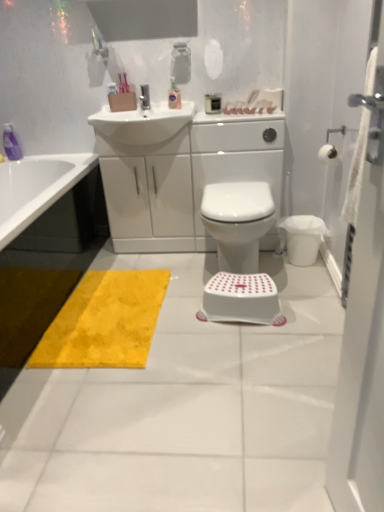
Describe the element at coordinates (105, 322) in the screenshot. I see `yellow fuzzy rug at lower left` at that location.

Describe the element at coordinates (238, 222) in the screenshot. I see `white plastic bidet at center` at that location.

This screenshot has width=384, height=512. What do you see at coordinates (145, 97) in the screenshot?
I see `metallic silver faucet at upper center` at bounding box center [145, 97].

Based on the photo, what is the approximate width of translucent plastic bottle at upper center?

The width of translucent plastic bottle at upper center is 4.55 inches.

What is the approximate width of white plastic step stool at center?

The width of white plastic step stool at center is 27.04 centimeters.

Image resolution: width=384 pixels, height=512 pixels. What do you see at coordinates (327, 153) in the screenshot?
I see `white matte toilet paper at upper right` at bounding box center [327, 153].

This screenshot has height=512, width=384. What do you see at coordinates (142, 123) in the screenshot? I see `white glossy sink at upper center` at bounding box center [142, 123].

The image size is (384, 512). Find the location of `yellow fuzzy rug at lower left`. yellow fuzzy rug at lower left is located at coordinates (105, 322).

Considering the positions of point (379, 499) and point (321, 152), is point (379, 499) closer or farther from the camera than point (321, 152)?

Point (379, 499).

Locate an element on the screen. The width and height of the screenshot is (384, 512). screen door located below the white matte toilet paper at upper right (from the image's perspective) is located at coordinates (362, 351).

Looking at this image, is white fabric screen door at right wider than white matte toilet paper at upper right?

In fact, white fabric screen door at right might be narrower than white matte toilet paper at upper right.

Choose the correct answer: Is white fabric screen door at right inside white matte toilet paper at upper right or outside it?

white fabric screen door at right exists outside the volume of white matte toilet paper at upper right.

Looking at this image, is white plastic step stool at center situated inside white glossy sink at upper center or outside?

white plastic step stool at center is not inside white glossy sink at upper center, it's outside.

Which is closer to the camera, [267,286] or [193,116]?

The point [267,286] is closer.

Which of these two, white plastic step stool at center or white glossy sink at upper center, is smaller?

With smaller size is white plastic step stool at center.

Is metallic silver faucet at upper center taller or shorter than white plastic bidet at center?

Clearly, metallic silver faucet at upper center is shorter compared to white plastic bidet at center.

Could white plastic bidet at center be considered to be inside metallic silver faucet at upper center?

No, metallic silver faucet at upper center does not contain white plastic bidet at center.

Which point is more forward, (146, 87) or (266, 226)?

The point (266, 226) is closer to the camera.

Which of these two, yellow fuzzy rug at lower left or white matte toilet paper at upper right, stands shorter?

yellow fuzzy rug at lower left.

From a real-world perspective, is yellow fuzzy rug at lower left over white matte toilet paper at upper right?

No, from a real-world perspective, yellow fuzzy rug at lower left is not over white matte toilet paper at upper right

Is white matte toilet paper at upper right at the back of yellow fuzzy rug at lower left?

No, yellow fuzzy rug at lower left's orientation is not away from white matte toilet paper at upper right.

Which point is more distant from viewer, (115,283) or (332,146)?

The point (115,283) is farther.

Is white fabric screen door at right far from translucent plastic bottle at upper center?

white fabric screen door at right is positioned a significant distance from translucent plastic bottle at upper center.

Who is shorter, white fabric screen door at right or translucent plastic bottle at upper center?

translucent plastic bottle at upper center is shorter.

Is white fabric screen door at right turned away from translucent plastic bottle at upper center?

white fabric screen door at right is not turned away from translucent plastic bottle at upper center.

This screenshot has height=512, width=384. I want to click on tap located below the translucent plastic bottle at upper center (from the image's perspective), so click(x=145, y=97).

How many degrees apart are the facing directions of metallic silver faucet at upper center and translucent plastic bottle at upper center?

0.000822 degrees separate the facing orientations of metallic silver faucet at upper center and translucent plastic bottle at upper center.

Is metallic silver faucet at upper center taller than translucent plastic bottle at upper center?

In fact, metallic silver faucet at upper center may be shorter than translucent plastic bottle at upper center.

Is metallic silver faucet at upper center completely or partially outside of translucent plastic bottle at upper center?

Yes, metallic silver faucet at upper center is located beyond the bounds of translucent plastic bottle at upper center.

Where is `doormat directly beneath the white fabric screen door at right (from a real-world perspective)`? This screenshot has width=384, height=512. doormat directly beneath the white fabric screen door at right (from a real-world perspective) is located at coordinates (105, 322).

Is yellow fuzzy rug at lower left oriented away from white fabric screen door at right?

No.

Looking at this image, from the image's perspective, does yellow fuzzy rug at lower left appear lower than white fabric screen door at right?

Indeed, from the image's perspective, yellow fuzzy rug at lower left is shown beneath white fabric screen door at right.

Would you say white fabric screen door at right is part of yellow fuzzy rug at lower left's contents?

No, white fabric screen door at right is located outside of yellow fuzzy rug at lower left.

The width and height of the screenshot is (384, 512). In order to click on screen door on the left of white matte toilet paper at upper right in this screenshot , I will do `click(362, 351)`.

This screenshot has height=512, width=384. Identify the location of sink located above the white plastic step stool at center (from a real-world perspective). (142, 123).

From the image, which object appears to be nearer to metallic silver faucet at upper center, white plastic bidet at center or translucent plastic bottle at upper center?

The object closer to metallic silver faucet at upper center is translucent plastic bottle at upper center.

Considering their positions, is translucent plastic bottle at upper center positioned further to white matte toilet paper at upper right than white glossy sink at upper center?

Based on the image, white glossy sink at upper center appears to be further to white matte toilet paper at upper right.

Based on their spatial positions, is white fabric screen door at right or white plastic bidet at center closer to translucent plastic bottle at upper center?

white plastic bidet at center.

Considering their positions, is white matte toilet paper at upper right positioned further to metallic silver faucet at upper center than white plastic bidet at center?

white matte toilet paper at upper right is further to metallic silver faucet at upper center.

Which object lies further to the anchor point white plastic step stool at center, white matte toilet paper at upper right or translucent plastic bottle at upper center?

translucent plastic bottle at upper center lies further to white plastic step stool at center than the other object.

Looking at the image, which one is located further to white glossy sink at upper center, yellow fuzzy rug at lower left or metallic silver faucet at upper center?

yellow fuzzy rug at lower left is further to white glossy sink at upper center.

When comparing their distances from white plastic bidet at center, does white plastic step stool at center or yellow fuzzy rug at lower left seem closer?

white plastic step stool at center is positioned closer to the anchor white plastic bidet at center.

Considering their positions, is white plastic step stool at center positioned closer to metallic silver faucet at upper center than yellow fuzzy rug at lower left?

yellow fuzzy rug at lower left is closer to metallic silver faucet at upper center.

Identify the location of tap between white glossy sink at upper center and translucent plastic bottle at upper center from front to back. The width and height of the screenshot is (384, 512). (145, 97).

Where is `step stool positioned between white fabric screen door at right and metallic silver faucet at upper center from near to far`? Image resolution: width=384 pixels, height=512 pixels. step stool positioned between white fabric screen door at right and metallic silver faucet at upper center from near to far is located at coordinates (241, 298).

Locate an element on the screen. sink that lies between translucent plastic bottle at upper center and yellow fuzzy rug at lower left from top to bottom is located at coordinates (142, 123).

This screenshot has width=384, height=512. I want to click on bidet between white glossy sink at upper center and white plastic step stool at center in the vertical direction, so click(238, 222).